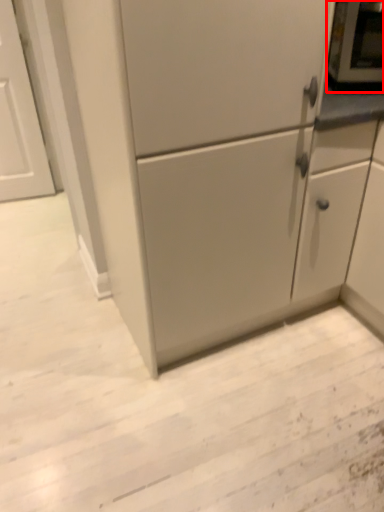
Question: From the image's perspective, where is appliance (annotated by the red box) located relative to cabinetry?

Choices:
 (A) above
 (B) below

Answer: (A)